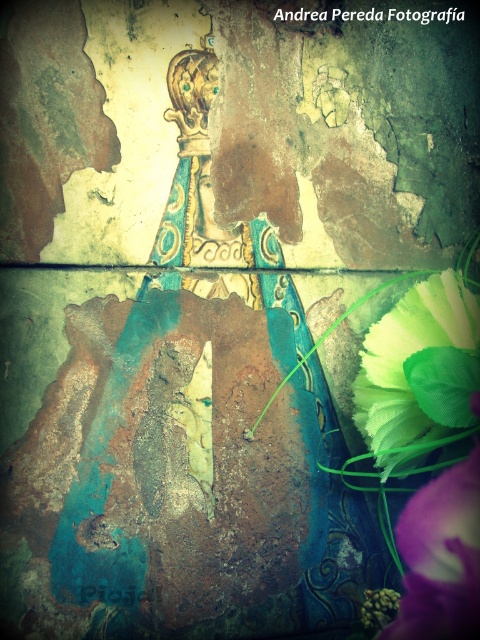
You are standing 30 inches away from the wall. If you move forward by 5 inches, will the point at point (444, 305) become closer to you than the wall?

The distance of point (444, 305) from camera is 35.42 inches. After moving forward 5 inches from your current position of 30 inches away from the wall, you will be 25 inches away. Since 25 inches is less than 35.42 inches, the point will be closer to you than the wall.

You are standing in front of the wall and want to place a small sticker on the wall. You have two points marked as point 1 and point 2. If point 1 is at coordinate [420,314] and point 2 is at [470,477], which point is closer to you?

Point 2 at [470,477] is closer to you because point 1 at [420,314] is behind it.